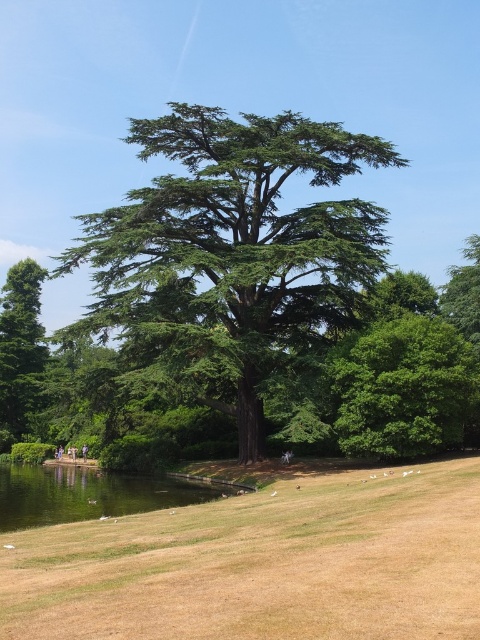
Question: Does green leafy tree at center appear on the left side of green matte tree at left?

Choices:
 (A) yes
 (B) no

Answer: (B)

Question: Which point is farther to the camera?

Choices:
 (A) green matte tree at left
 (B) green leafy tree at center
 (C) green textured tree at center

Answer: (A)

Question: Observing the image, what is the correct spatial positioning of brown grass at lower center in reference to brown leather jacket at center?

Choices:
 (A) above
 (B) below

Answer: (A)

Question: Among these objects, which one is nearest to the camera?

Choices:
 (A) green matte tree at left
 (B) brown grass at lower center
 (C) green textured tree at center

Answer: (B)

Question: Is green leafy tree at center bigger than green matte tree at left?

Choices:
 (A) yes
 (B) no

Answer: (B)

Question: Which point is farther to the camera?

Choices:
 (A) brown leather jacket at center
 (B) green textured tree at center
 (C) green matte tree at left
 (D) green leafy tree at center

Answer: (A)